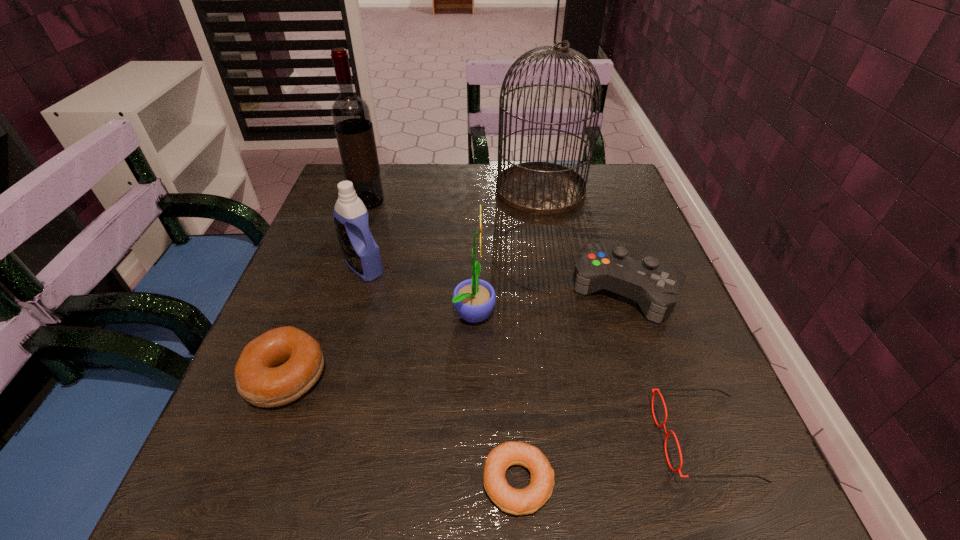
Where is `birdcage`? birdcage is located at coordinates (542, 188).

The image size is (960, 540). Identify the location of wine bottle. (351, 116).

In order to click on sunflower in this screenshot , I will do `click(474, 299)`.

You are a GUI agent. You are given a task and a screenshot of the screen. Output one action in this format:
    pyautogui.click(x=<x>, y=<y>)
    Task: Click on the fifth shortest object
    The width and height of the screenshot is (960, 540).
    Given the screenshot: What is the action you would take?
    pyautogui.click(x=362, y=255)

Locate an element on the screen. control is located at coordinates (656, 286).

At what (x,y) coordinates should I click in order to perform the action: click on the farther bagel. Please return your answer as a coordinate pair (x, y). The height and width of the screenshot is (540, 960). Looking at the image, I should click on (276, 368).

You are a GUI agent. You are given a task and a screenshot of the screen. Output one action in this format:
    pyautogui.click(x=<x>, y=<y>)
    Task: Click on the sixth tallest object
    This screenshot has height=540, width=960.
    Given the screenshot: What is the action you would take?
    pyautogui.click(x=276, y=368)

The width and height of the screenshot is (960, 540). I want to click on spectacles, so click(x=656, y=390).

Locate an element on the screen. The image size is (960, 540). the right bagel is located at coordinates (528, 500).

Find the location of a particular element. the nearer bagel is located at coordinates (528, 500).